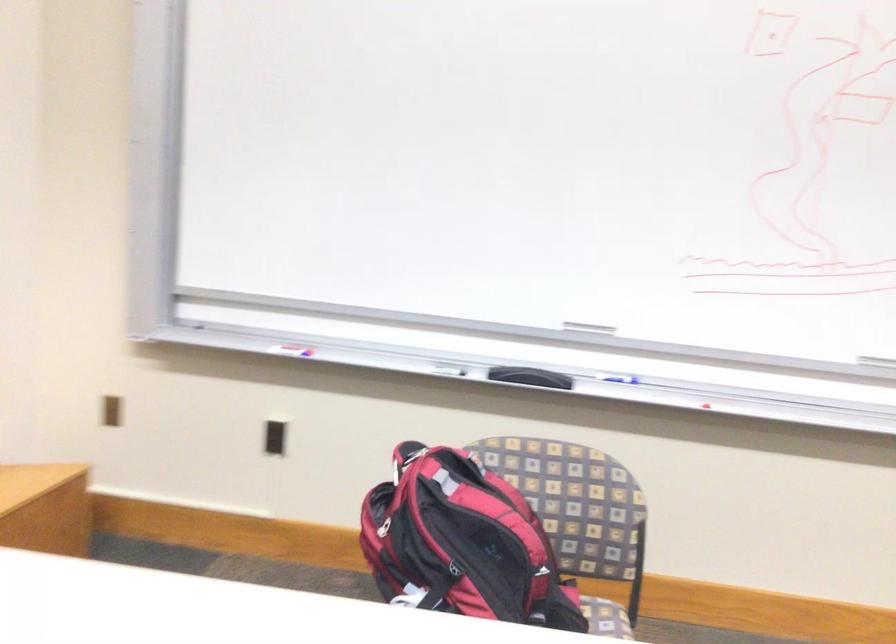
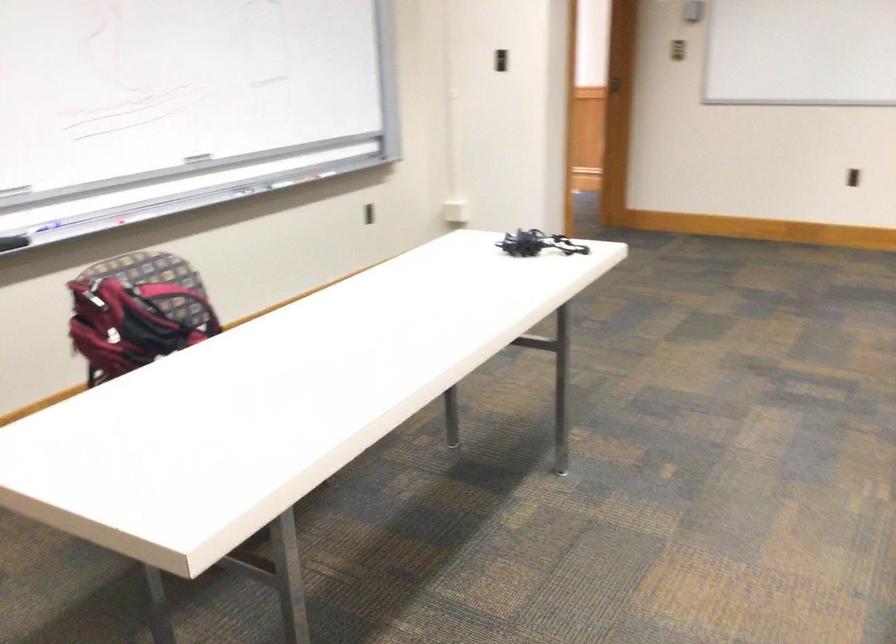
In the second image, find the point that corresponds to point 596,534 in the first image.

(177, 301)